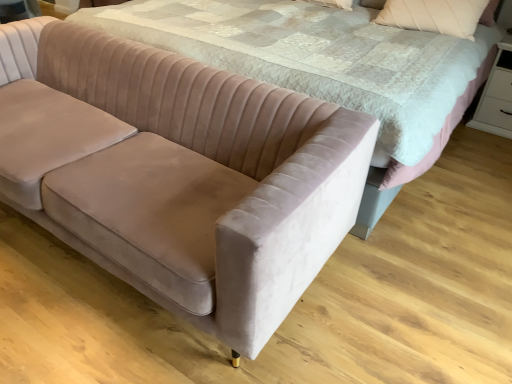
Question: From a real-world perspective, is velvet beige pillow at upper right above or below velvet beige couch at lower left?

Choices:
 (A) below
 (B) above

Answer: (B)

Question: From their relative heights in the image, would you say velvet beige pillow at upper right is taller or shorter than velvet beige couch at lower left?

Choices:
 (A) tall
 (B) short

Answer: (B)

Question: Which object is the farthest from the white glossy dresser at lower right?

Choices:
 (A) velvet beige couch at lower left
 (B) velvet pink bed at center
 (C) velvet beige pillow at upper right

Answer: (A)

Question: Which object is the closest to the velvet beige couch at lower left?

Choices:
 (A) white glossy dresser at lower right
 (B) velvet beige pillow at upper right
 (C) velvet pink bed at center

Answer: (C)